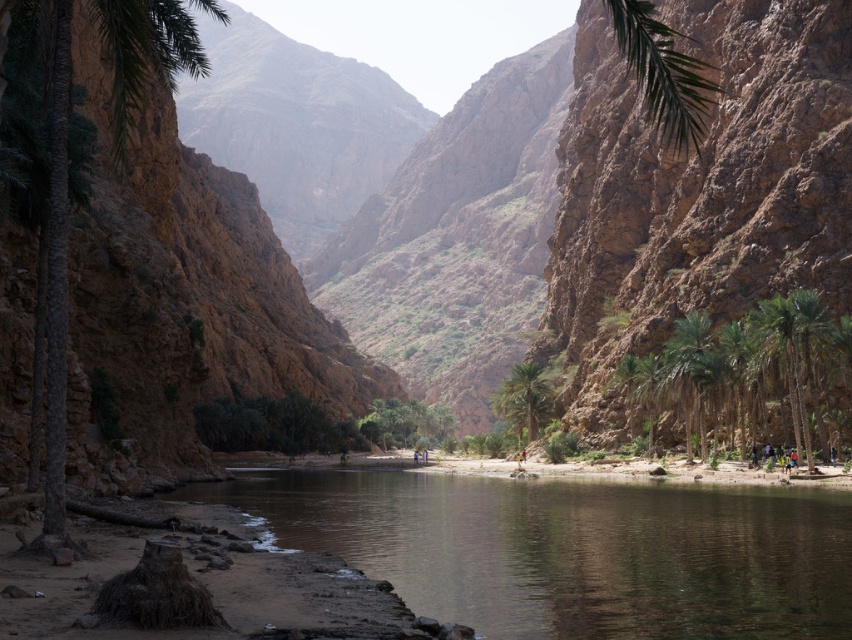
Does brown rough rock at upper right have a lesser height compared to green leafy palm tree at center?

In fact, brown rough rock at upper right may be taller than green leafy palm tree at center.

Who is shorter, brown rough rock at upper right or green leafy palm tree at center?

With less height is green leafy palm tree at center.

Which is behind, point (712, 56) or point (511, 365)?

The point (511, 365) is more distant.

This screenshot has width=852, height=640. Find the location of `brown rough rock at upper right`. brown rough rock at upper right is located at coordinates (697, 189).

Does brown smooth river at center have a greater width compared to green leafy palm tree at center?

Yes, brown smooth river at center is wider than green leafy palm tree at center.

Who is positioned more to the left, brown smooth river at center or green leafy palm tree at center?

Positioned to the left is brown smooth river at center.

At what (x,y) coordinates should I click in order to perform the action: click on brown smooth river at center. Please return your answer as a coordinate pair (x, y). This screenshot has height=640, width=852. Looking at the image, I should click on pyautogui.click(x=573, y=548).

Identify the location of brown smooth river at center. (573, 548).

Is brown rough rock at upper right positioned at the back of green leafy palm tree at center-right?

That is False.

Who is more distant from viewer, (622, 74) or (684, 401)?

Point (622, 74)

Is point (820, 77) positioned behind point (704, 321)?

Yes, point (820, 77) is farther from viewer.

Find the location of a particular element. This screenshot has height=640, width=852. brown rough rock at upper right is located at coordinates (697, 189).